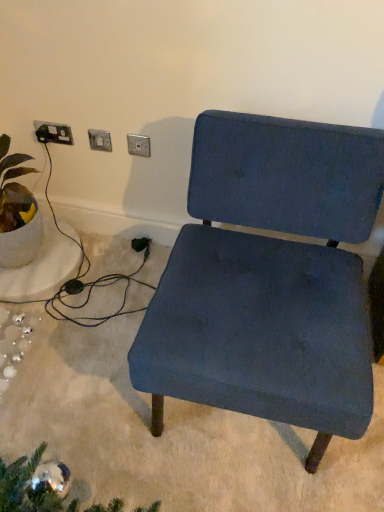
Question: From the image's perspective, would you say matte silver switch at upper center, arranged as the second electric outlet when viewed from the right, is shown under green leafy plant in white pot at left?

Choices:
 (A) no
 (B) yes

Answer: (A)

Question: Does matte silver switch at upper center, which appears as the 2th electric outlet when viewed from the left, have a greater height compared to green leafy plant in white pot at left?

Choices:
 (A) no
 (B) yes

Answer: (A)

Question: From the image's perspective, is matte silver switch at upper center, arranged as the second electric outlet when viewed from the right, over green leafy plant in white pot at left?

Choices:
 (A) yes
 (B) no

Answer: (A)

Question: Does matte silver switch at upper center, which appears as the 2th electric outlet when viewed from the left, appear on the left side of green leafy plant in white pot at left?

Choices:
 (A) no
 (B) yes

Answer: (A)

Question: Is the depth of matte silver switch at upper center, which appears as the 2th electric outlet when viewed from the left, greater than that of green leafy plant in white pot at left?

Choices:
 (A) yes
 (B) no

Answer: (A)

Question: Is green leafy plant in white pot at left wider or thinner than black plastic socket at upper left, placed as the 3th electric outlet when sorted from right to left?

Choices:
 (A) thin
 (B) wide

Answer: (B)

Question: In the image, is green leafy plant in white pot at left positioned in front of or behind black plastic socket at upper left, the first electric outlet positioned from the left?

Choices:
 (A) front
 (B) behind

Answer: (A)

Question: Is green leafy plant in white pot at left taller or shorter than black plastic socket at upper left, placed as the 3th electric outlet when sorted from right to left?

Choices:
 (A) short
 (B) tall

Answer: (B)

Question: From the image's perspective, is green leafy plant in white pot at left above or below black plastic socket at upper left, placed as the 3th electric outlet when sorted from right to left?

Choices:
 (A) below
 (B) above

Answer: (A)

Question: Is point coord(130,138) closer or farther from the camera than point coord(51,124)?

Choices:
 (A) closer
 (B) farther

Answer: (A)

Question: Is metallic silver outlet at upper center, which is the third electric outlet in left-to-right order, inside the boundaries of black plastic socket at upper left, placed as the 3th electric outlet when sorted from right to left, or outside?

Choices:
 (A) outside
 (B) inside

Answer: (A)

Question: In the image, is metallic silver outlet at upper center, which is the third electric outlet in left-to-right order, positioned in front of or behind black plastic socket at upper left, the first electric outlet positioned from the left?

Choices:
 (A) behind
 (B) front

Answer: (B)

Question: From the image's perspective, is metallic silver outlet at upper center, which is the third electric outlet in left-to-right order, located above or below black plastic socket at upper left, placed as the 3th electric outlet when sorted from right to left?

Choices:
 (A) above
 (B) below

Answer: (B)

Question: Based on their positions, is matte blue fabric chair at center located to the left or right of matte silver switch at upper center, which appears as the 2th electric outlet when viewed from the left?

Choices:
 (A) left
 (B) right

Answer: (B)

Question: In the image, is matte blue fabric chair at center positioned in front of or behind matte silver switch at upper center, arranged as the second electric outlet when viewed from the right?

Choices:
 (A) behind
 (B) front

Answer: (B)